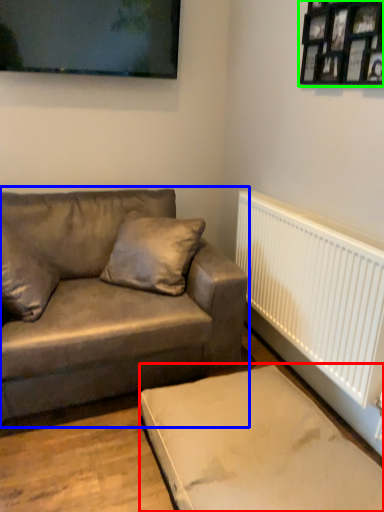
Question: Based on their relative distances, which object is nearer to furniture (highlighted by a red box)? Choose from studio couch (highlighted by a blue box) and picture frame (highlighted by a green box).

Choices:
 (A) studio couch
 (B) picture frame

Answer: (A)